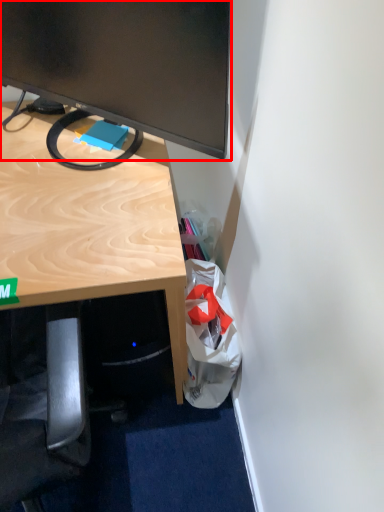
Question: Considering the relative positions of television (annotated by the red box) and shopping bag in the image provided, where is television (annotated by the red box) located with respect to the staircase?

Choices:
 (A) left
 (B) right

Answer: (A)